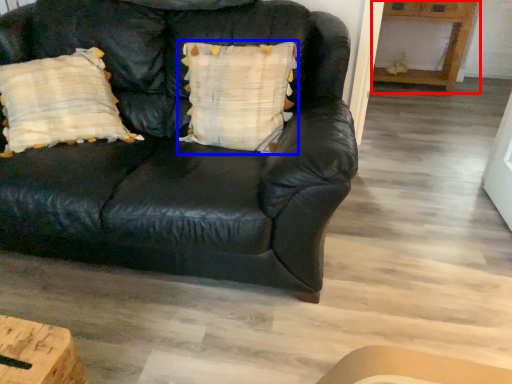
Question: Among these objects, which one is farthest to the camera, table (highlighted by a red box) or pillow (highlighted by a blue box)?

Choices:
 (A) table
 (B) pillow

Answer: (A)